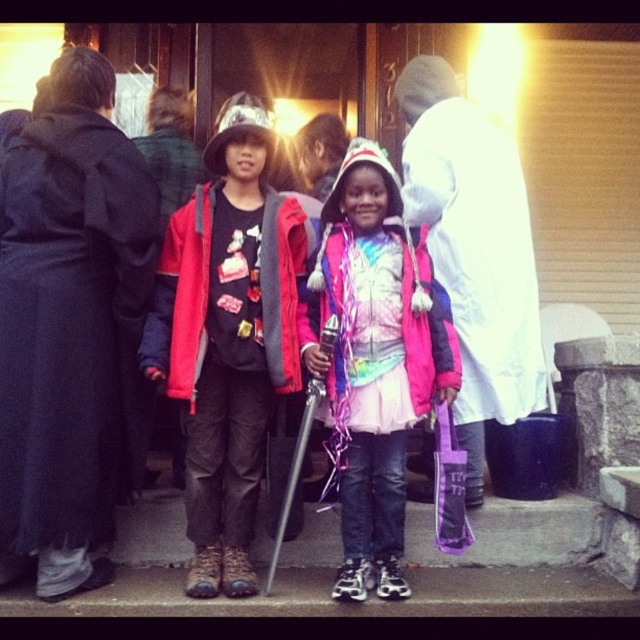
Which is more to the right, black matte robe at left or pink matte jacket at center?

pink matte jacket at center is more to the right.

Does black matte robe at left appear on the right side of pink matte jacket at center?

Incorrect, black matte robe at left is not on the right side of pink matte jacket at center.

Locate an element on the screen. black matte robe at left is located at coordinates (72, 330).

At what (x,y) coordinates should I click in order to perform the action: click on black matte robe at left. Please return your answer as a coordinate pair (x, y). This screenshot has width=640, height=640. Looking at the image, I should click on (72, 330).

Does pink fabric umbrella at center appear over matte red jacket at center?

Yes.

Does pink fabric umbrella at center appear on the left side of matte red jacket at center?

Incorrect, pink fabric umbrella at center is not on the left side of matte red jacket at center.

What do you see at coordinates (474, 250) in the screenshot? I see `pink fabric umbrella at center` at bounding box center [474, 250].

I want to click on pink fabric umbrella at center, so click(474, 250).

How distant is pink matte jacket at center from matte red jacket at center?

pink matte jacket at center is 30.14 inches away from matte red jacket at center.

Does pink matte jacket at center have a greater height compared to matte red jacket at center?

Indeed, pink matte jacket at center has a greater height compared to matte red jacket at center.

Is point (317, 240) farther from camera compared to point (296, 234)?

That is True.

Locate an element on the screen. Image resolution: width=640 pixels, height=640 pixels. pink matte jacket at center is located at coordinates (376, 360).